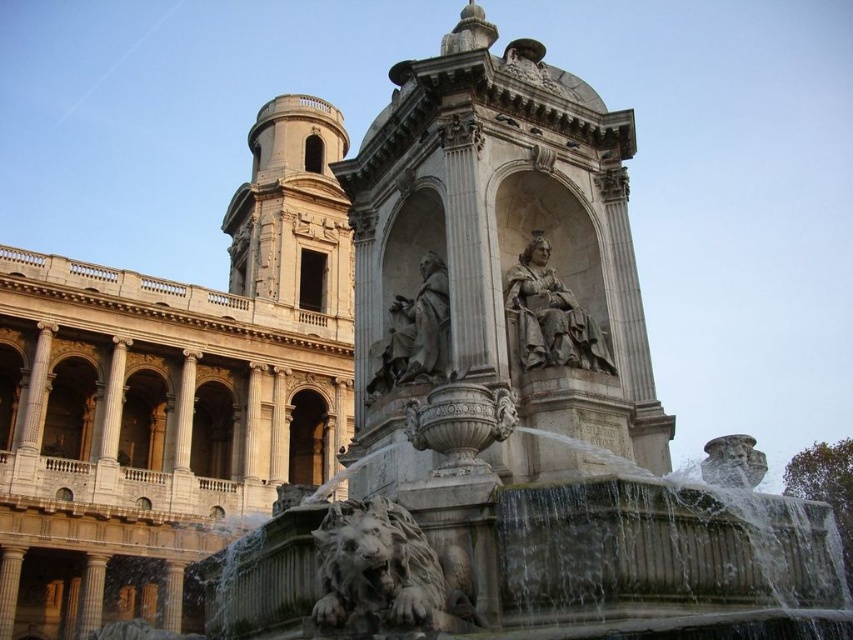
You are standing in the grand architectural scene described. There is a point at coordinates point (550, 316). What object is this point located on?

The point (550, 316) is located on the polished stone statue at center.

You are standing at the point with coordinates point [399,369] and want to walk to the point with coordinates point [566,358]. According to the scene description, will you be moving towards the building or away from it?

Since point [566,358] is in front of point [399,369], moving from point [399,369] to point [566,358] means you are moving towards the building behind the fountain.